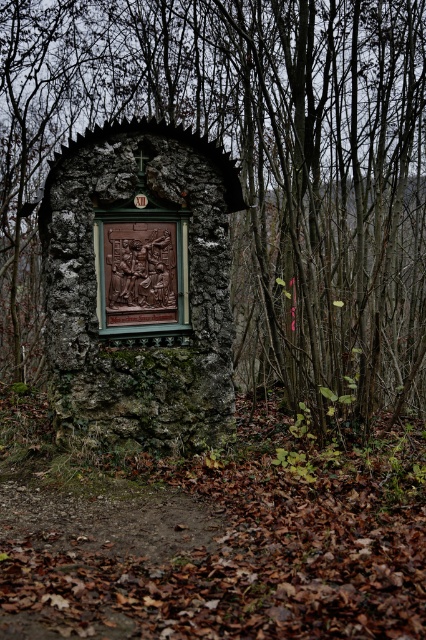
Question: Does brown stone carving at center have a greater width compared to brown carved stone at center?

Choices:
 (A) yes
 (B) no

Answer: (B)

Question: Which point appears closest to the camera in this image?

Choices:
 (A) (253, 61)
 (B) (89, 312)

Answer: (B)

Question: Does brown stone carving at center come behind brown carved stone at center?

Choices:
 (A) yes
 (B) no

Answer: (A)

Question: Can you confirm if brown stone carving at center is smaller than brown carved stone at center?

Choices:
 (A) no
 (B) yes

Answer: (B)

Question: Among these points, which one is farthest from the camera?

Choices:
 (A) (249, 28)
 (B) (164, 212)

Answer: (A)